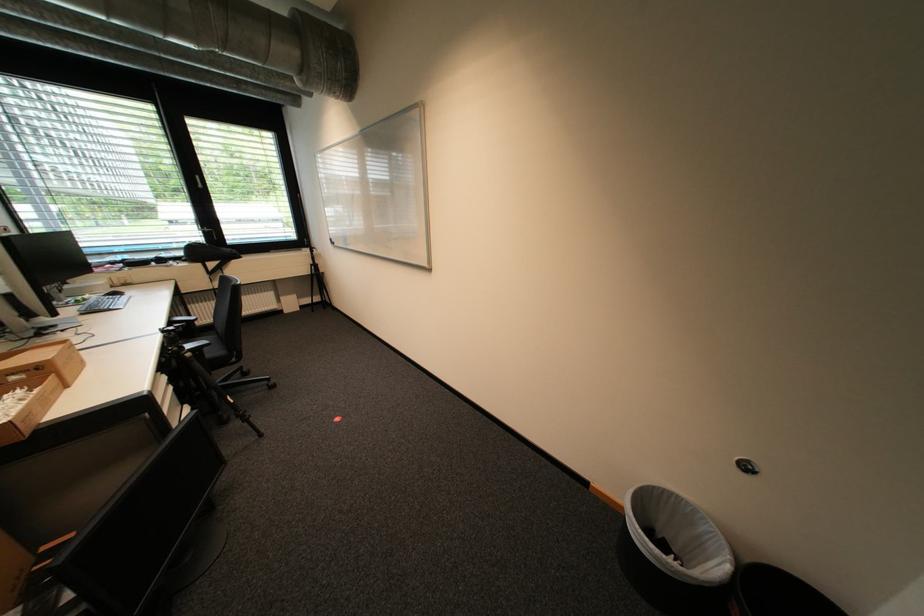
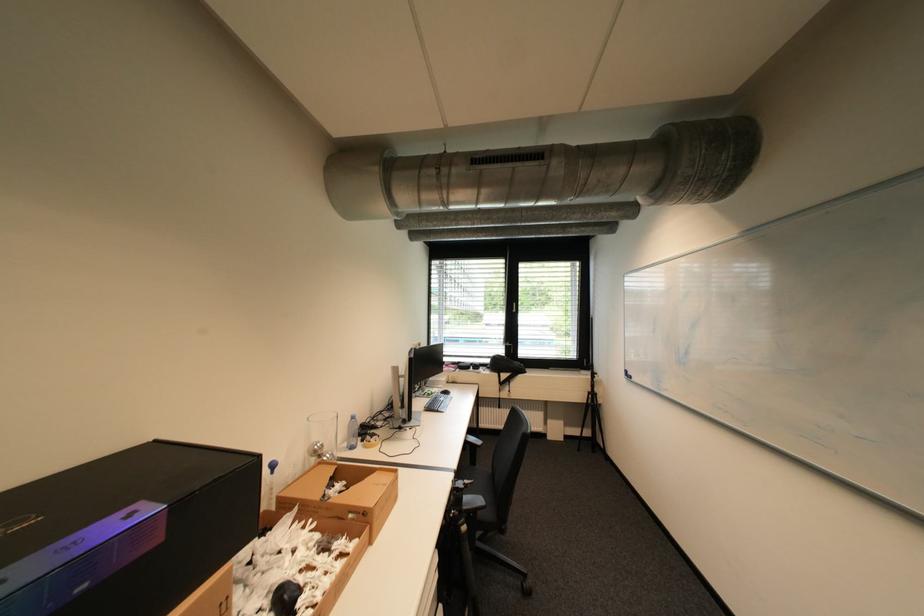
Question: The camera is either moving clockwise (left) or counter-clockwise (right) around the object. The first image is from the beginning of the video and the second image is from the end. Is the camera moving left or right when shooting the video?

Choices:
 (A) Left
 (B) Right

Answer: (B)